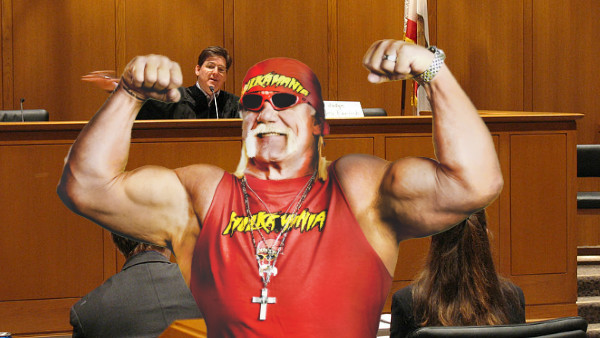
Find the location of a particular element. The image size is (600, 338). wall is located at coordinates (388, 33).